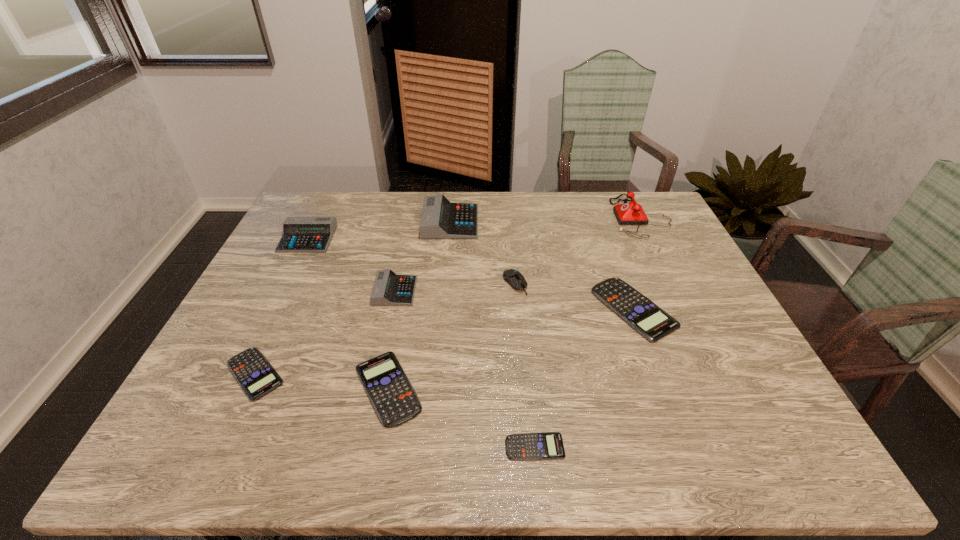
Locate an element on the screen. This screenshot has height=540, width=960. empty location between the smallest gray calculator and the computer mouse is located at coordinates (455, 287).

The height and width of the screenshot is (540, 960). Identify the location of empty location between the smallest gray calculator and the third shortest calculator. (392, 340).

Where is `empty space between the red telephone and the third biggest blue calculator`? empty space between the red telephone and the third biggest blue calculator is located at coordinates 447,295.

Locate an element on the screen. This screenshot has height=540, width=960. free point between the nearest calculator and the computer mouse is located at coordinates (525, 365).

Where is `the second closest object to the tallest calculator`? the second closest object to the tallest calculator is located at coordinates click(389, 289).

Locate an element on the screen. the third closest object to the second smallest blue calculator is located at coordinates pos(299,234).

Find the location of a particular element. The width and height of the screenshot is (960, 540). the fifth closest calculator to the third smallest blue calculator is located at coordinates (653, 323).

Locate an element on the screen. This screenshot has width=960, height=540. calculator that is the sixth nearest to the smallest gray calculator is located at coordinates (653, 323).

Identify which gray calculator is the second closest to the third tallest calculator. Please provide its 2D coordinates. Your answer should be formatted as a tuple, i.e. [(x, y)], where the tuple contains the x and y coordinates of a point satisfying the conditions above.

[(299, 234)]

Image resolution: width=960 pixels, height=540 pixels. Identify the location of gray calculator that can be found as the closest to the computer mouse. (440, 219).